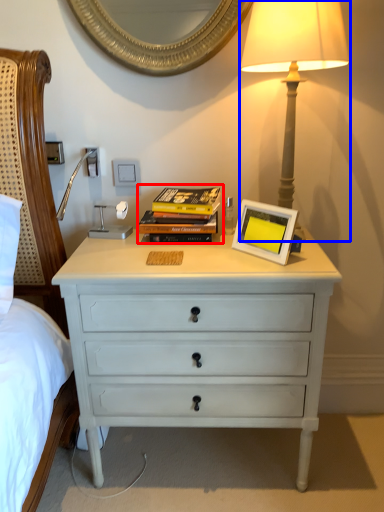
Question: Which object is further to the camera taking this photo, magazine (highlighted by a red box) or bedside lamp (highlighted by a blue box)?

Choices:
 (A) magazine
 (B) bedside lamp

Answer: (A)